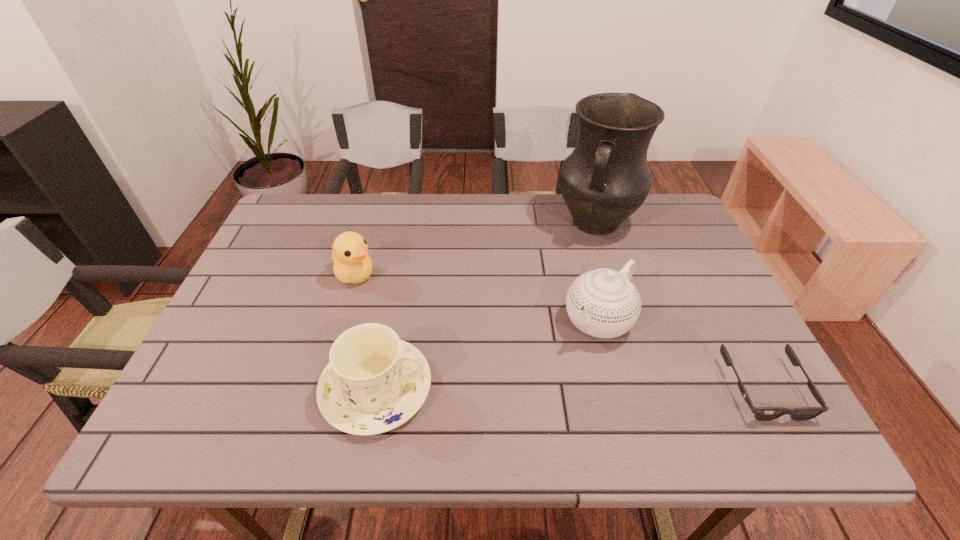
Where is `vacant space located on the spout of the taller chinaware`? Image resolution: width=960 pixels, height=540 pixels. vacant space located on the spout of the taller chinaware is located at coordinates (543, 375).

Locate an element on the screen. The width and height of the screenshot is (960, 540). vacant area located 0.110m on the face of the second farthest object is located at coordinates (400, 301).

Identify the location of vacant space located 0.350m on the face of the second farthest object. (476, 347).

Locate an element on the screen. The width and height of the screenshot is (960, 540). blank area located on the face of the second farthest object is located at coordinates (446, 329).

Find the location of `vacant space situated 0.180m on the handle side of the tallest object`. vacant space situated 0.180m on the handle side of the tallest object is located at coordinates (566, 288).

Where is `free region located 0.310m on the handle side of the tallest object`? This screenshot has height=540, width=960. free region located 0.310m on the handle side of the tallest object is located at coordinates (551, 322).

The image size is (960, 540). I want to click on free space located on the handle side of the tallest object, so click(x=552, y=320).

This screenshot has width=960, height=540. Find the location of `object located at the far edge`. object located at the far edge is located at coordinates [x=606, y=178].

You are a GUI agent. You are given a task and a screenshot of the screen. Output one action in this format:
    pyautogui.click(x=<x>, y=<y>)
    Task: Click on the chinaware that is at the near edge
    This screenshot has height=540, width=960.
    Given the screenshot: What is the action you would take?
    pyautogui.click(x=374, y=382)

Where is `sunglasses that is at the near edge`? sunglasses that is at the near edge is located at coordinates (760, 413).